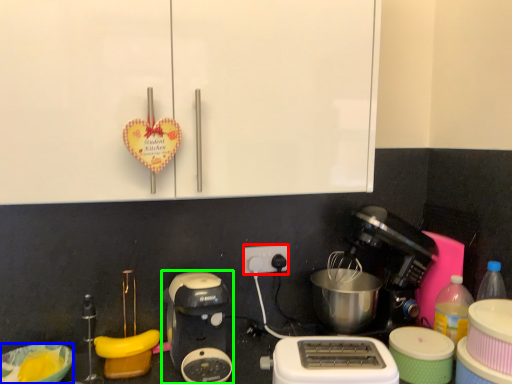
Question: Which is farther away from power plugs and sockets (highlighted by a red box)? bowl (highlighted by a blue box) or coffee maker (highlighted by a green box)?

Choices:
 (A) bowl
 (B) coffee maker

Answer: (A)